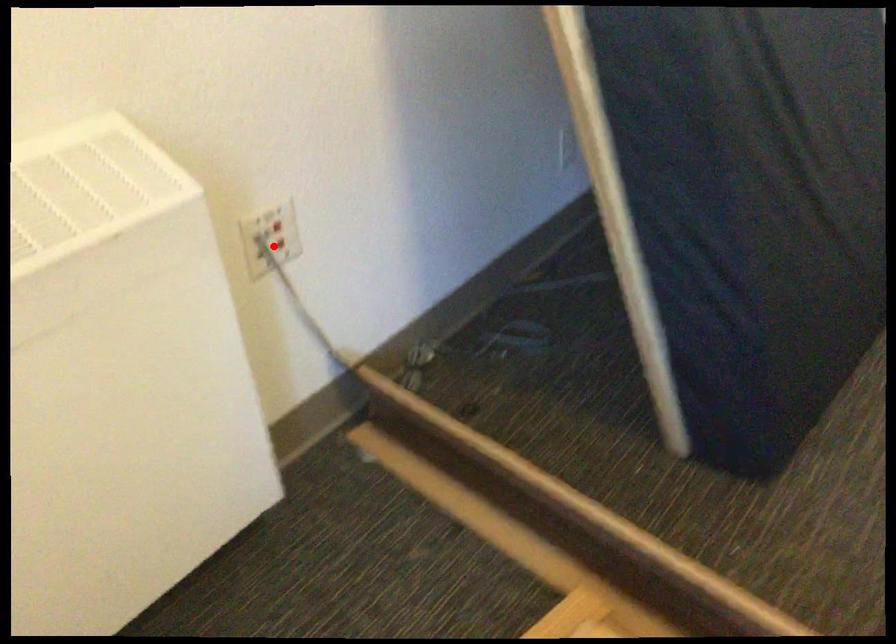
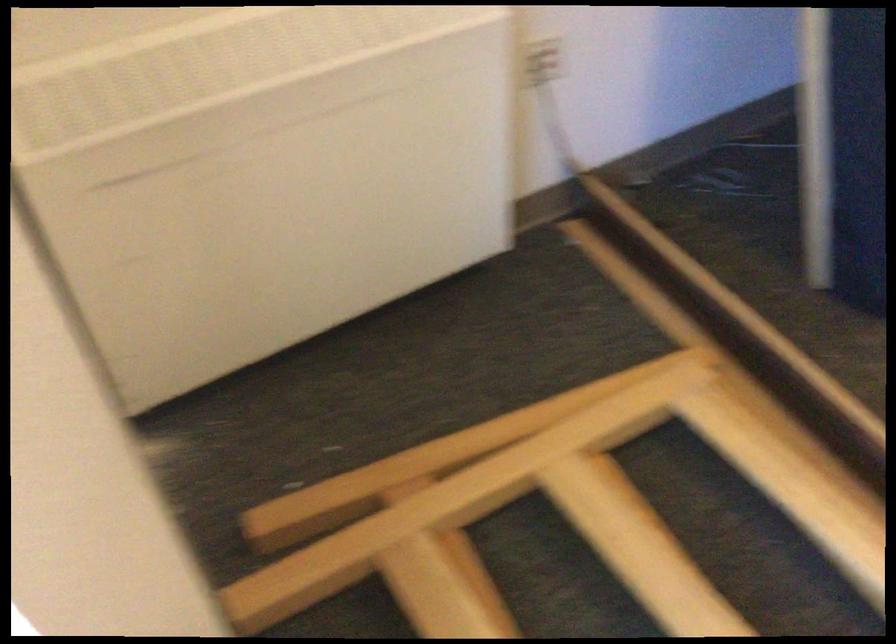
Where in the second image is the point corresponding to the highlighted location from the first image?

(543, 62)